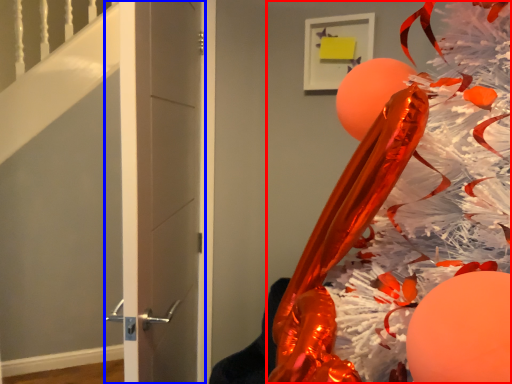
Question: Which object is closer to the camera taking this photo, christmas tree (highlighted by a red box) or door (highlighted by a blue box)?

Choices:
 (A) christmas tree
 (B) door

Answer: (A)